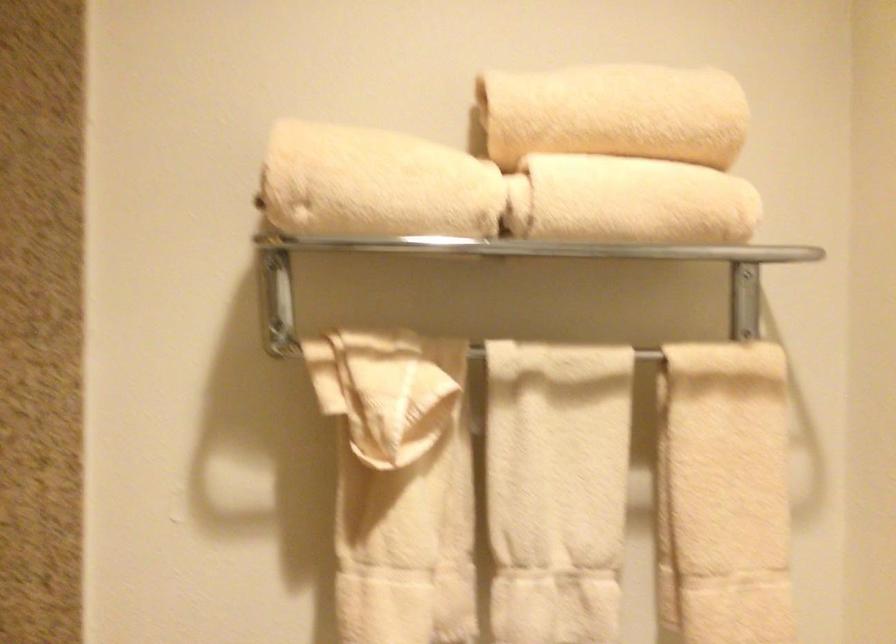
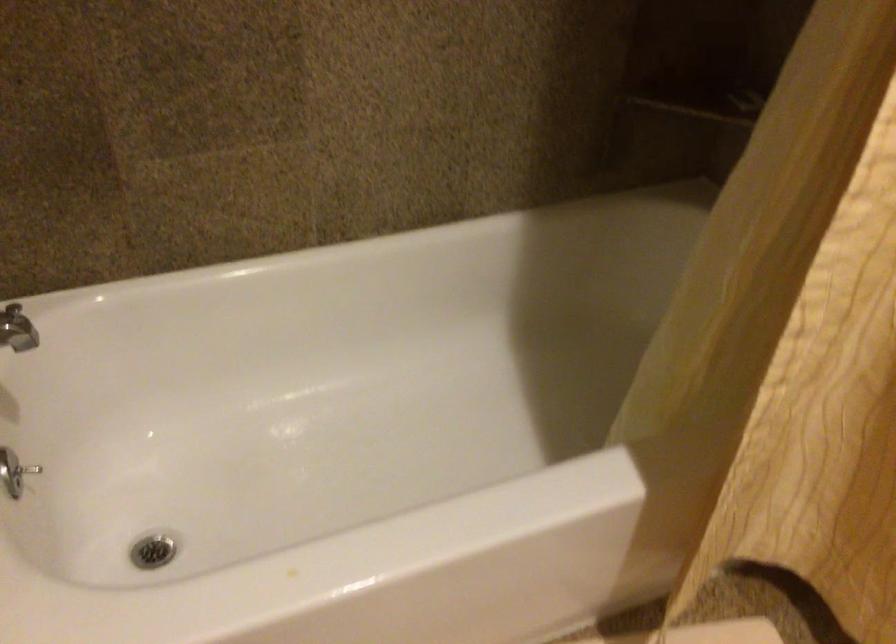
How did the camera likely rotate?

The camera's rotation is toward left-down.